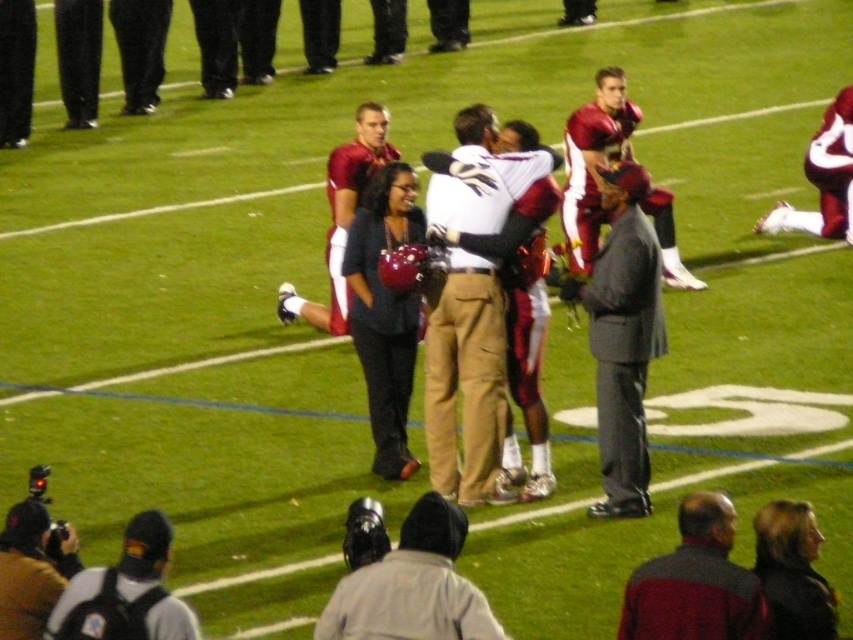
Question: Is maroon uniform at center smaller than black fabric backpack at lower left?

Choices:
 (A) yes
 (B) no

Answer: (B)

Question: Is the position of dark gray jacket at center less distant than that of maroon uniform at center?

Choices:
 (A) no
 (B) yes

Answer: (B)

Question: Among these points, which one is farthest from the camera?

Choices:
 (A) (589, 301)
 (B) (495, 627)
 (C) (532, 444)

Answer: (C)

Question: Which is nearer to the matte black camera at lower left?

Choices:
 (A) maroon uniform at center
 (B) gray fabric jacket at lower center

Answer: (B)

Question: Is dark gray jacket at center to the left of black fabric backpack at lower left from the viewer's perspective?

Choices:
 (A) yes
 (B) no

Answer: (B)

Question: Which point is farther from the camera taking this photo?

Choices:
 (A) (x=703, y=541)
 (B) (x=360, y=132)
 (C) (x=582, y=262)
 (D) (x=70, y=564)

Answer: (C)